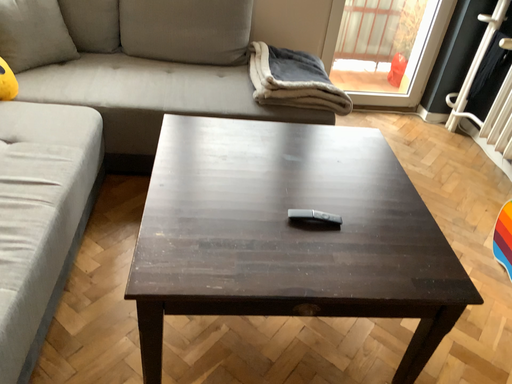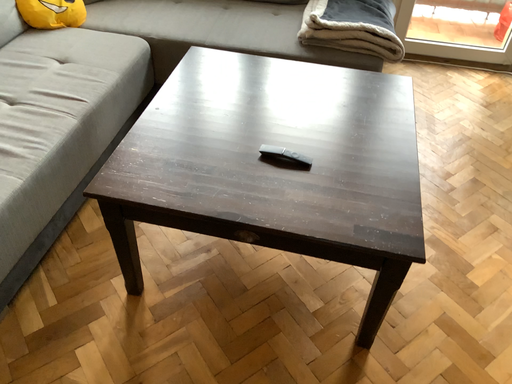
Question: Which way did the camera rotate in the video?

Choices:
 (A) rotated left
 (B) rotated right

Answer: (A)